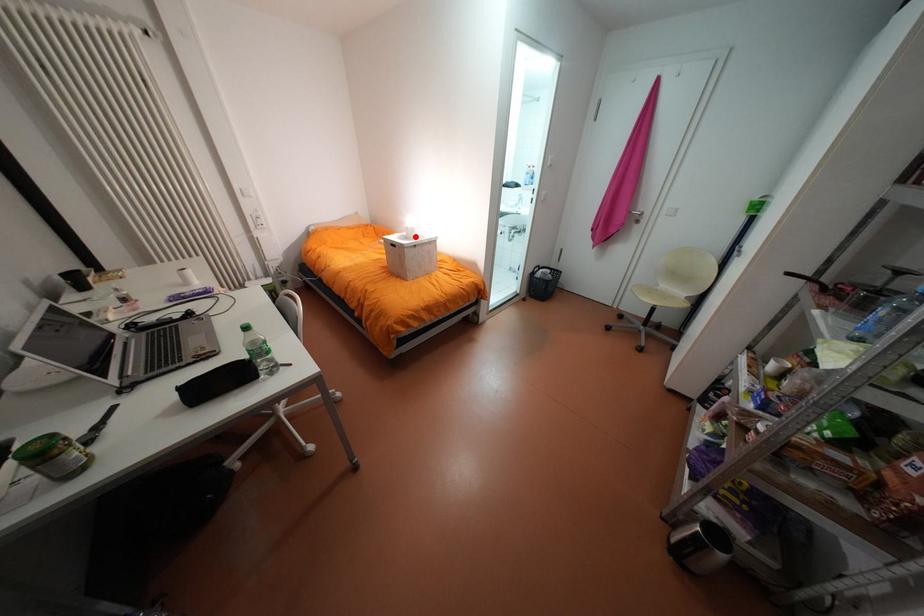
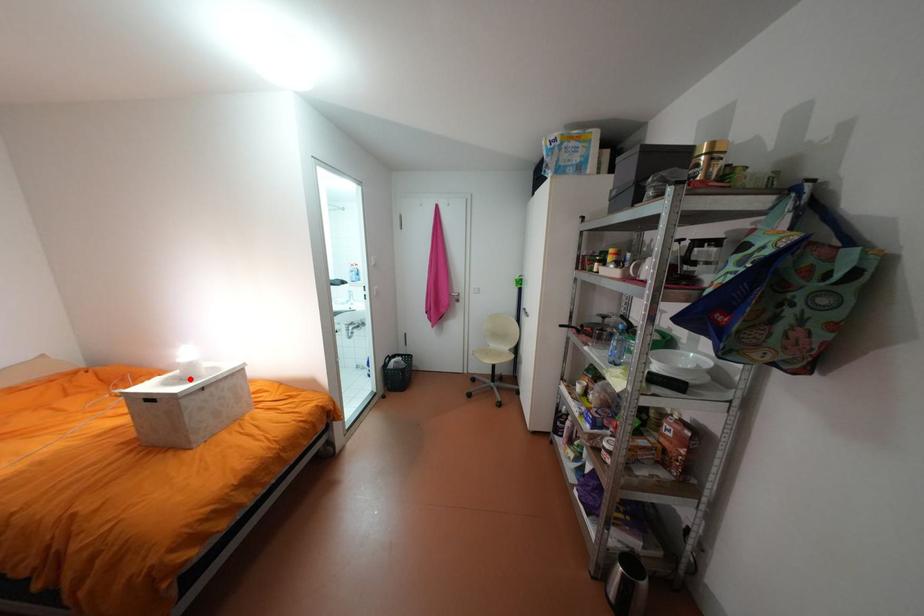
I am providing you with two images of the same scene from different viewpoints. A red point is marked on the first image and another point is marked on the second image. Do the highlighted points in image1 and image2 indicate the same real-world spot?

Yes